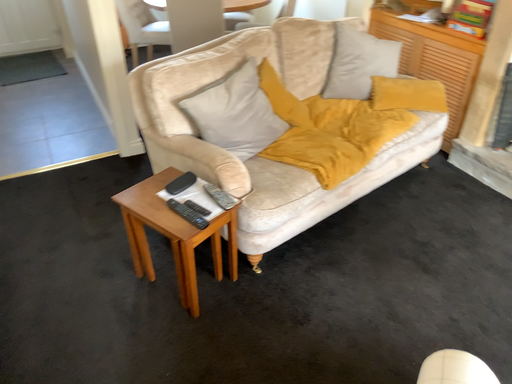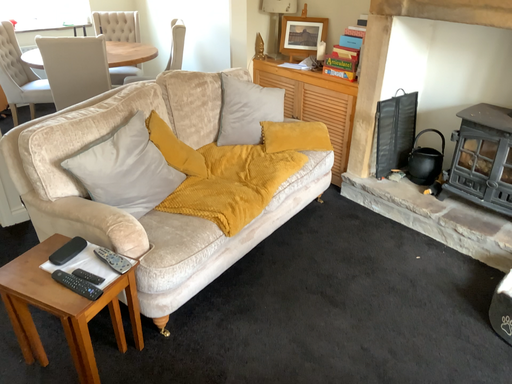
Question: How did the camera likely rotate when shooting the video?

Choices:
 (A) rotated upward
 (B) rotated downward

Answer: (A)